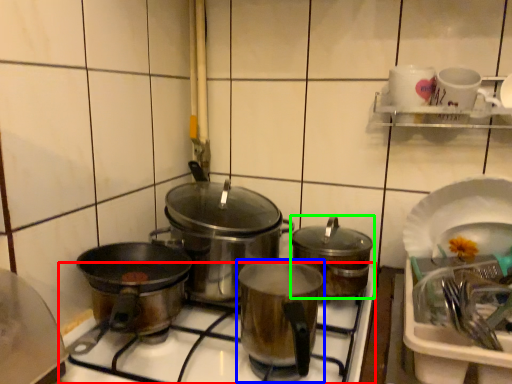
Question: Considering the real-world distances, which object is closest to gas stove (highlighted by a red box)? kitchen appliance (highlighted by a blue box) or kitchen appliance (highlighted by a green box).

Choices:
 (A) kitchen appliance
 (B) kitchen appliance

Answer: (A)